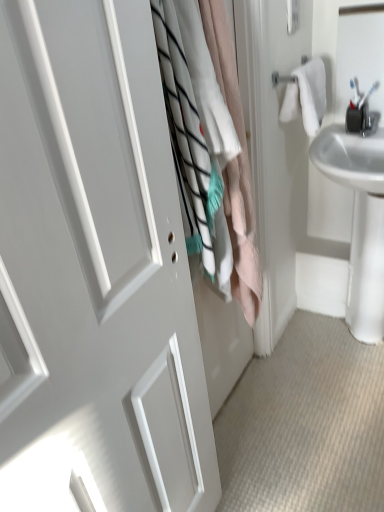
The width and height of the screenshot is (384, 512). What are the coordinates of `vacant space in white cotton laundry at center (from a real-world perspective)` in the screenshot? It's located at (248, 406).